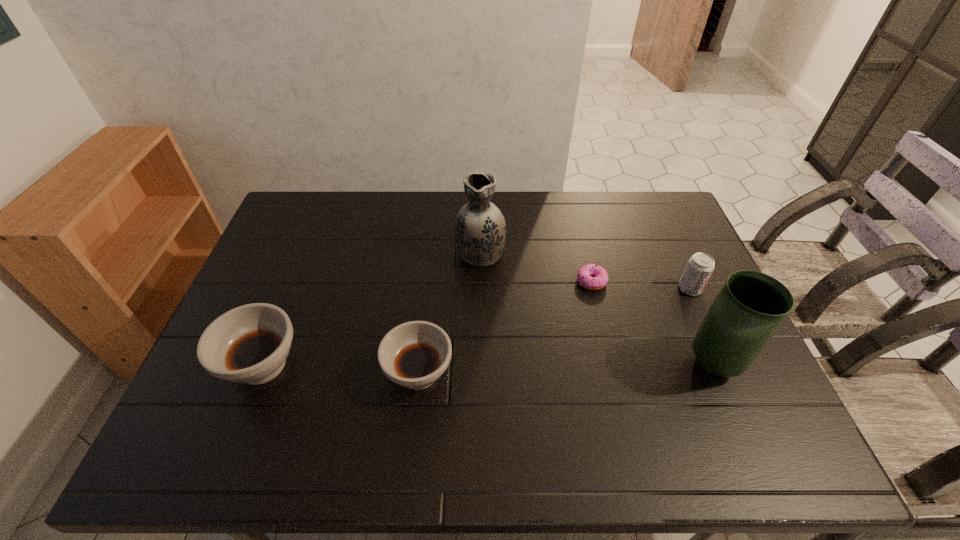
The height and width of the screenshot is (540, 960). I want to click on vacant space situated 0.070m on the left of the second shortest object, so click(357, 373).

Find the location of a particular element. This screenshot has width=960, height=540. free space located 0.060m with the handle on the side of the farther vase is located at coordinates coord(480,222).

In order to click on free space located with the handle on the side of the farther vase in this screenshot , I will do `click(480, 221)`.

What are the coordinates of `free space located with the handle on the side of the farther vase` in the screenshot? It's located at (480, 214).

Find the location of a particular element. The image size is (960, 540). vacant space located on the left of the nearer vase is located at coordinates (604, 364).

Locate an element on the screen. The image size is (960, 540). free location located 0.280m on the right of the third object from right to left is located at coordinates (699, 281).

Locate an element on the screen. The width and height of the screenshot is (960, 540). vacant space located on the back of the soda can is located at coordinates (677, 260).

Locate an element on the screen. This screenshot has height=540, width=960. object present at the far edge is located at coordinates pos(480,229).

The height and width of the screenshot is (540, 960). Identify the location of vase at the near edge. (751, 306).

The image size is (960, 540). I want to click on object that is at the left edge, so click(249, 344).